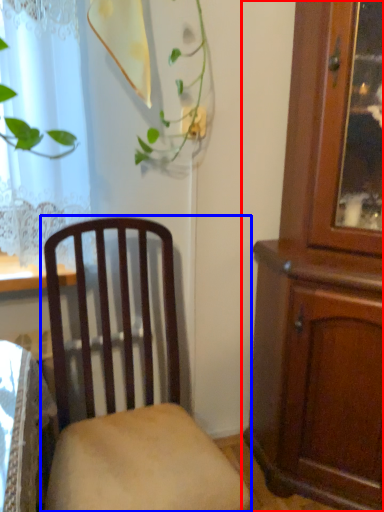
Question: Which point is closer to the camera, cabinetry (highlighted by a red box) or chair (highlighted by a blue box)?

Choices:
 (A) cabinetry
 (B) chair

Answer: (B)